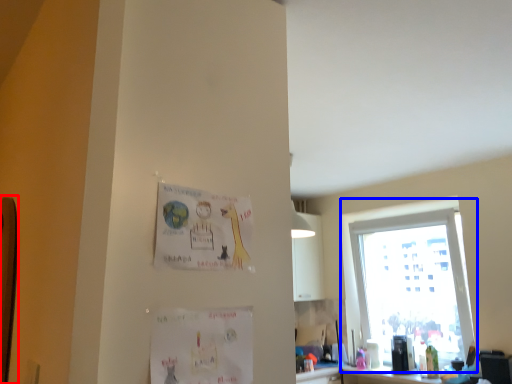
Question: Which point is further to the camera, bulletin board (highlighted by a red box) or window (highlighted by a blue box)?

Choices:
 (A) bulletin board
 (B) window

Answer: (B)